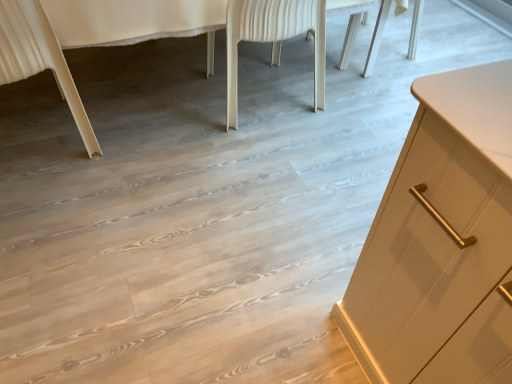
Question: Considering the positions of light beige wood chair leg at lower left, placed as the 1th chair when sorted from left to right, and white wood chair at center, which appears as the second chair when viewed from the left, in the image, is light beige wood chair leg at lower left, placed as the 1th chair when sorted from left to right, bigger or smaller than white wood chair at center, which appears as the second chair when viewed from the left,?

Choices:
 (A) small
 (B) big

Answer: (A)

Question: Is light beige wood chair leg at lower left, placed as the 1th chair when sorted from left to right, taller or shorter than white wood chair at center, which appears as the second chair when viewed from the left?

Choices:
 (A) tall
 (B) short

Answer: (A)

Question: Which is farther from the white wood chair at center, marked as the 1th chair in a right-to-left arrangement?

Choices:
 (A) white glossy cabinet at right
 (B) light beige wood chair leg at lower left, placed as the 1th chair when sorted from left to right

Answer: (B)

Question: Estimate the real-world distances between objects in this image. Which object is farther from the light beige wood chair leg at lower left, placed as the 1th chair when sorted from left to right?

Choices:
 (A) white wood chair at center, marked as the 1th chair in a right-to-left arrangement
 (B) white glossy cabinet at right

Answer: (A)